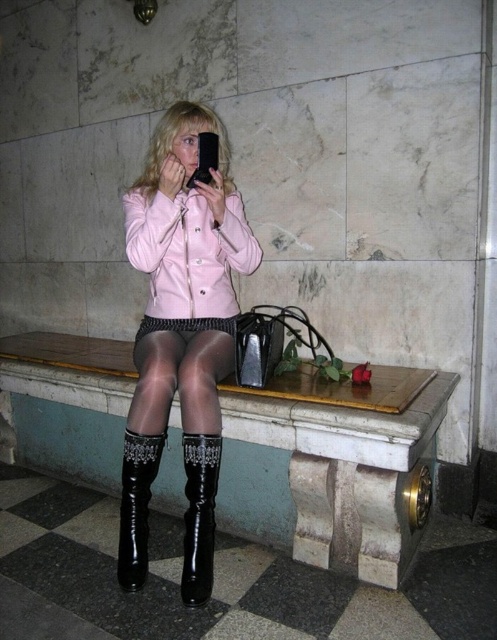
Does wooden bench at center have a lesser height compared to black leather boot at lower left?

Incorrect, wooden bench at center's height does not fall short of black leather boot at lower left's.

Who is lower down, wooden bench at center or black leather boot at lower left?

black leather boot at lower left is below.

Locate an element on the screen. Image resolution: width=497 pixels, height=640 pixels. wooden bench at center is located at coordinates (350, 460).

This screenshot has height=640, width=497. In order to click on wooden bench at center in this screenshot , I will do `click(350, 460)`.

Between point (195, 381) and point (191, 554), which one is positioned in front?

Point (191, 554) is in front.

Is sheer black tights at center above black leather boot at lower center?

Yes, sheer black tights at center is above black leather boot at lower center.

Who is more distant from viewer, (152, 358) or (187, 566)?

Point (152, 358)

Image resolution: width=497 pixels, height=640 pixels. Identify the location of sheer black tights at center. (179, 380).

Is glossy patent leather boots at lower center thinner than black leather boot at lower center?

In fact, glossy patent leather boots at lower center might be wider than black leather boot at lower center.

From the picture: Is glossy patent leather boots at lower center above black leather boot at lower center?

Correct, glossy patent leather boots at lower center is located above black leather boot at lower center.

Is point (189, 376) farther from viewer compared to point (201, 509)?

Yes, point (189, 376) is behind point (201, 509).

The image size is (497, 640). Identify the location of glossy patent leather boots at lower center. (180, 333).